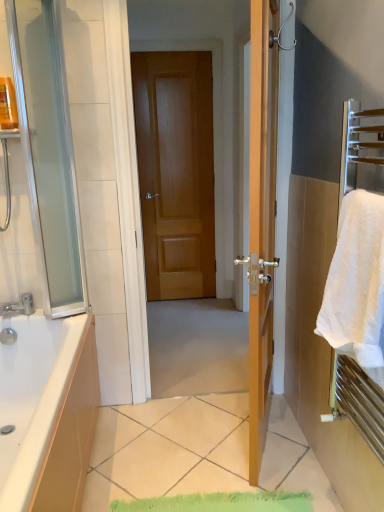
Question: Is wooden door at center closer to the viewer compared to brushed metal faucet at lower left?

Choices:
 (A) yes
 (B) no

Answer: (B)

Question: From the image's perspective, is wooden door at center on brushed metal faucet at lower left?

Choices:
 (A) yes
 (B) no

Answer: (A)

Question: Does wooden door at center have a greater width compared to brushed metal faucet at lower left?

Choices:
 (A) yes
 (B) no

Answer: (B)

Question: Is wooden door at center looking in the opposite direction of brushed metal faucet at lower left?

Choices:
 (A) no
 (B) yes

Answer: (A)

Question: From a real-world perspective, is wooden door at center beneath brushed metal faucet at lower left?

Choices:
 (A) yes
 (B) no

Answer: (B)

Question: In terms of size, does white fluffy towel at right appear bigger or smaller than brushed metal faucet at lower left?

Choices:
 (A) small
 (B) big

Answer: (B)

Question: Considering the positions of white fluffy towel at right and brushed metal faucet at lower left in the image, is white fluffy towel at right taller or shorter than brushed metal faucet at lower left?

Choices:
 (A) tall
 (B) short

Answer: (A)

Question: From a real-world perspective, is white fluffy towel at right above or below brushed metal faucet at lower left?

Choices:
 (A) above
 (B) below

Answer: (A)

Question: In the image, is white fluffy towel at right on the left side or the right side of brushed metal faucet at lower left?

Choices:
 (A) left
 (B) right

Answer: (B)

Question: In the image, is translucent plastic bottle at upper left positioned in front of or behind white fluffy towel at right?

Choices:
 (A) front
 (B) behind

Answer: (B)

Question: Is translucent plastic bottle at upper left inside or outside of white fluffy towel at right?

Choices:
 (A) inside
 (B) outside

Answer: (B)

Question: Is translucent plastic bottle at upper left to the left or to the right of white fluffy towel at right in the image?

Choices:
 (A) right
 (B) left

Answer: (B)

Question: Looking at the image, does translucent plastic bottle at upper left seem bigger or smaller compared to white fluffy towel at right?

Choices:
 (A) big
 (B) small

Answer: (B)

Question: Is transparent glass screen door at left wider or thinner than white fluffy towel at right?

Choices:
 (A) thin
 (B) wide

Answer: (A)

Question: Would you say transparent glass screen door at left is to the left or to the right of white fluffy towel at right in the picture?

Choices:
 (A) right
 (B) left

Answer: (B)